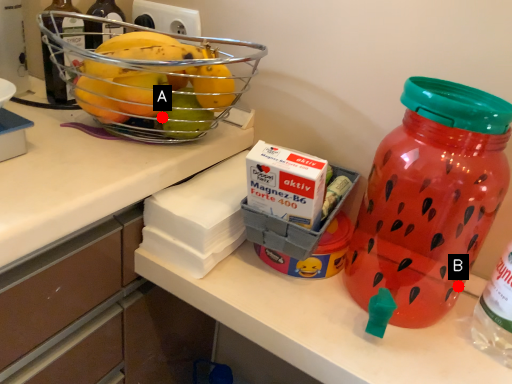
Question: Two points are circled on the image, labeled by A and B beside each circle. Which point is closer to the camera?

Choices:
 (A) A is closer
 (B) B is closer

Answer: (A)